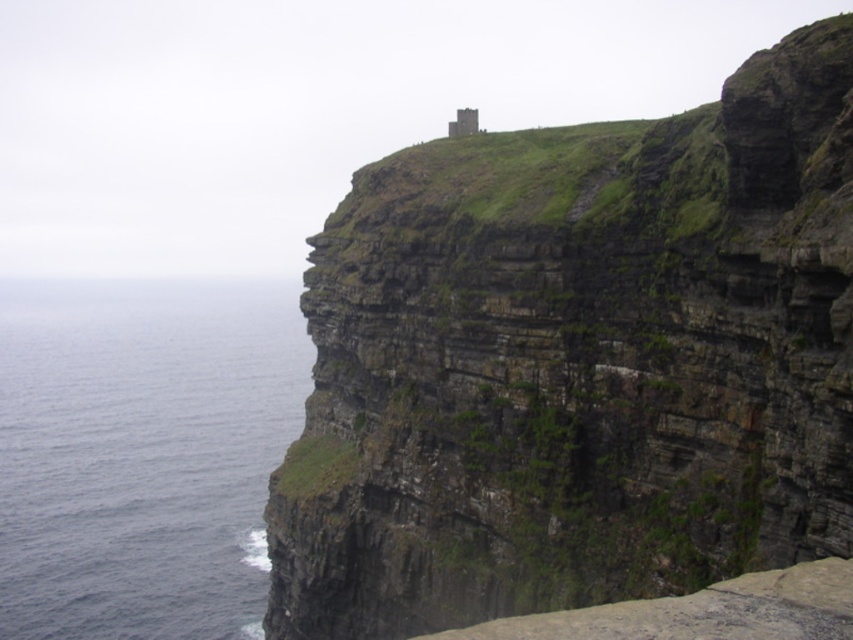
You are a hiker standing on the cliff and looking at the green mossy rock at upper center and the blue water at left. Which object is higher in elevation?

The green mossy rock at upper center is above the blue water at left, so it is higher in elevation.

You are standing on the cliff and want to look at the blue water at left. Which direction should you turn to see the green mossy rock at upper center?

The green mossy rock at upper center is to the right of the blue water at left, so you should turn to your right to see the green mossy rock at upper center.

You are a hiker standing at the base of the cliffs. You see the green mossy rock at upper center and the blue water at left. How far apart are these two landmarks?

The green mossy rock at upper center is 171.56 feet from the blue water at left.